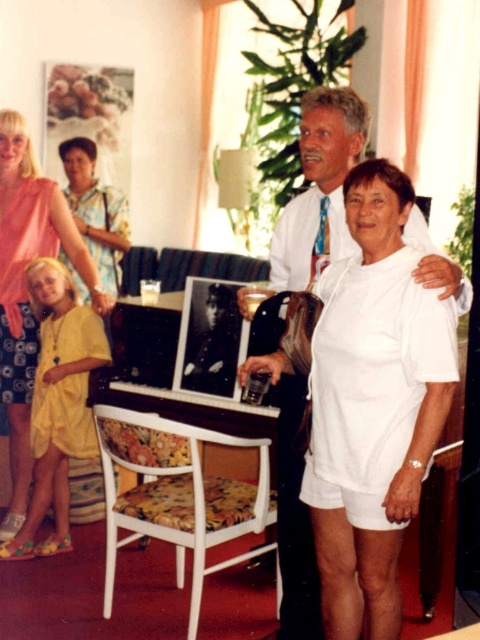
Question: Is white cotton shirt at center smaller than yellow cotton dress at lower left?

Choices:
 (A) no
 (B) yes

Answer: (A)

Question: Which is farther from the matte pink blouse at upper left?

Choices:
 (A) white cotton shirt at center
 (B) yellow cotton dress at lower left

Answer: (A)

Question: Does white cotton shirt at center appear under matte pink blouse at upper left?

Choices:
 (A) yes
 (B) no

Answer: (A)

Question: Which point is farther to the camera?

Choices:
 (A) (289, 532)
 (B) (32, 500)
 (C) (72, 182)

Answer: (C)

Question: Which point is farther from the camera taking this photo?

Choices:
 (A) (283, 221)
 (B) (97, 248)
 (C) (55, 522)

Answer: (B)

Question: Is white cotton shirt at center to the left of yellow cotton dress at lower left from the viewer's perspective?

Choices:
 (A) no
 (B) yes

Answer: (A)